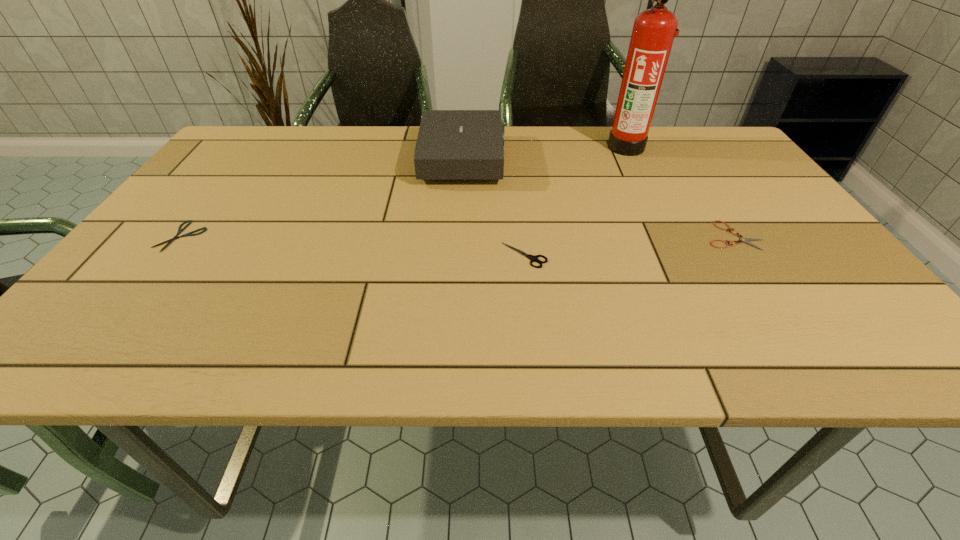
Where is `fire extinguisher`? This screenshot has height=540, width=960. fire extinguisher is located at coordinates (654, 29).

Image resolution: width=960 pixels, height=540 pixels. I want to click on the tallest object, so click(654, 29).

This screenshot has width=960, height=540. I want to click on projector, so click(x=452, y=144).

Locate an element on the screen. The height and width of the screenshot is (540, 960). the third shortest object is located at coordinates (534, 258).

The image size is (960, 540). What are the coordinates of `the second shears from right to left` in the screenshot? It's located at (534, 258).

Identify the location of the rightmost shears. (746, 240).

You are a GUI agent. You are given a task and a screenshot of the screen. Output one action in this format:
    pyautogui.click(x=<x>, y=<y>)
    Task: Click on the leftmost object
    The width and height of the screenshot is (960, 540).
    Given the screenshot: What is the action you would take?
    pyautogui.click(x=180, y=230)

Locate an element on the screen. free space located 0.250m with the nozzle pointing from the back of the second object from right to left is located at coordinates (520, 146).

Identify the location of vacant area located 0.150m with the nozzle pointing from the back of the second object from right to left. (555, 146).

The width and height of the screenshot is (960, 540). I want to click on free space located with the nozzle pointing from the back of the second object from right to left, so click(514, 146).